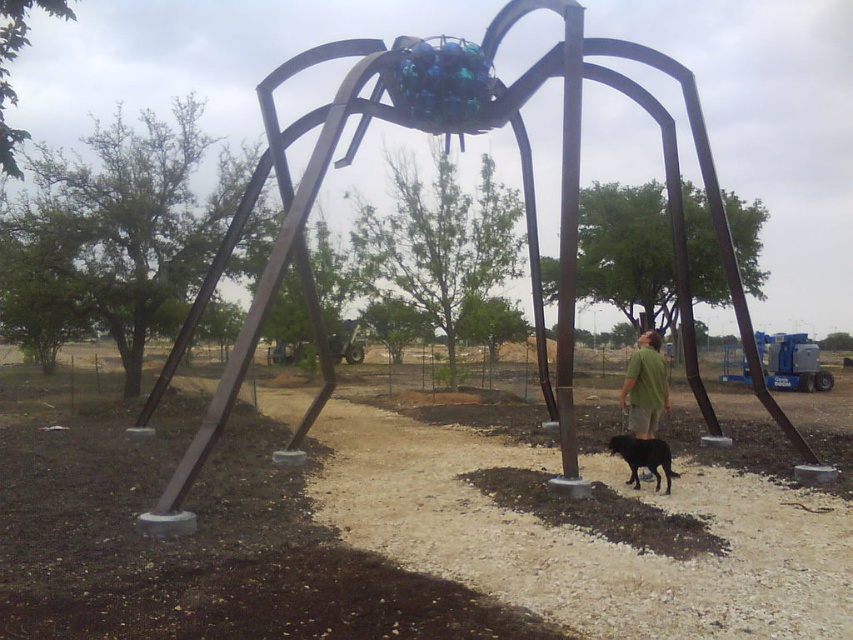
Question: Does brown gravel at center appear on the left side of black fur dog at lower right?

Choices:
 (A) no
 (B) yes

Answer: (B)

Question: Which object appears closest to the camera in this image?

Choices:
 (A) green matte shirt at center
 (B) black fur dog at lower right
 (C) metallic spider at center
 (D) brown gravel at center

Answer: (D)

Question: Considering the relative positions of brown gravel at center and black fur dog at lower right in the image provided, where is brown gravel at center located with respect to black fur dog at lower right?

Choices:
 (A) below
 (B) above

Answer: (B)

Question: Does metallic spider at center have a smaller size compared to green matte shirt at center?

Choices:
 (A) yes
 (B) no

Answer: (B)

Question: Among these points, which one is farthest from the camera?

Choices:
 (A) pyautogui.click(x=332, y=148)
 (B) pyautogui.click(x=541, y=556)
 (C) pyautogui.click(x=645, y=456)

Answer: (C)

Question: Which object is closer to the camera taking this photo?

Choices:
 (A) green matte shirt at center
 (B) metallic spider at center

Answer: (B)